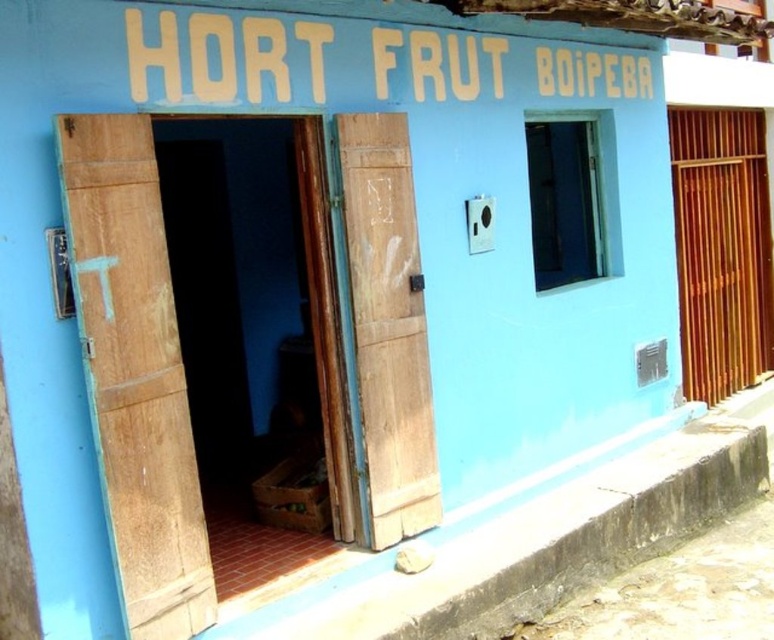
Question: Among these objects, which one is nearest to the camera?

Choices:
 (A) wooden at left
 (B) wooden door at center

Answer: (A)

Question: Is wooden at left bigger than wooden door at center?

Choices:
 (A) no
 (B) yes

Answer: (A)

Question: Which point is farther to the camera?

Choices:
 (A) wooden door at center
 (B) wooden at left

Answer: (A)

Question: Is wooden at left wider than wooden door at center?

Choices:
 (A) yes
 (B) no

Answer: (B)

Question: Among these objects, which one is farthest from the camera?

Choices:
 (A) wooden at left
 (B) wooden door at center

Answer: (B)

Question: Is the position of wooden at left less distant than that of wooden door at center?

Choices:
 (A) yes
 (B) no

Answer: (A)